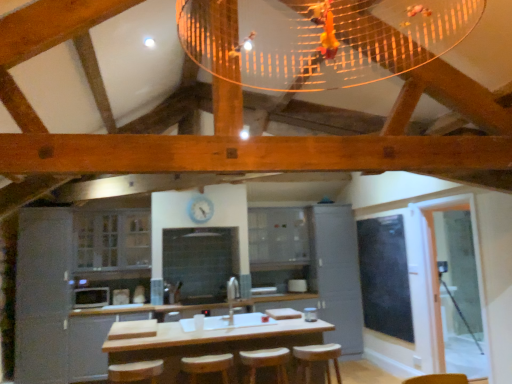
Question: Is point (82, 291) closer or farther from the camera than point (280, 372)?

Choices:
 (A) closer
 (B) farther

Answer: (B)

Question: In terms of size, does white glossy microwave at lower left appear bigger or smaller than wooden bar stool at center, the second bar stool viewed from the left?

Choices:
 (A) small
 (B) big

Answer: (A)

Question: Estimate the real-world distances between objects in this image. Which object is closer to the clear glass cabinets at center, the second cabinetry when ordered from left to right?

Choices:
 (A) black glass window screen at right
 (B) white glossy microwave at lower left
 (C) white plastic clock at upper center
 (D) clear glass screen door at right
 (E) wooden counter at center

Answer: (B)

Question: Which is farther from the black glass window screen at right?

Choices:
 (A) white plastic clock at upper center
 (B) white glossy microwave at lower left
 (C) matte gray cabinet at center, arranged as the 1th cabinetry when viewed from the right
 (D) wooden bar stool at center, the second bar stool viewed from the left
 (E) clear glass screen door at right

Answer: (B)